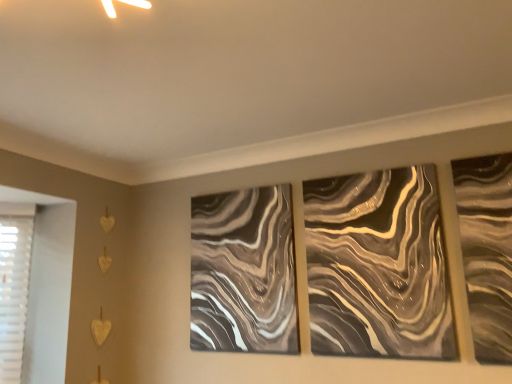
Question: Is metallic swirl art at center-right, acting as the first design starting from the right, at the left side of metallic swirl art at center, positioned as the second design in right-to-left order?

Choices:
 (A) yes
 (B) no

Answer: (B)

Question: Considering the relative sizes of metallic swirl art at center-right, acting as the first design starting from the right, and metallic swirl art at center, the first design from the left, in the image provided, is metallic swirl art at center-right, acting as the first design starting from the right, shorter than metallic swirl art at center, the first design from the left,?

Choices:
 (A) no
 (B) yes

Answer: (B)

Question: Are metallic swirl art at center-right, the 2th design from the left, and metallic swirl art at center, the first design from the left, beside each other?

Choices:
 (A) no
 (B) yes

Answer: (A)

Question: Can we say metallic swirl art at center-right, acting as the first design starting from the right, lies outside metallic swirl art at center, positioned as the second design in right-to-left order?

Choices:
 (A) no
 (B) yes

Answer: (B)

Question: Is metallic swirl art at center-right, the 2th design from the left, wider than metallic swirl art at center, positioned as the second design in right-to-left order?

Choices:
 (A) no
 (B) yes

Answer: (A)

Question: Is metallic swirl art at center-right, acting as the first design starting from the right, oriented towards metallic swirl art at center, the first design from the left?

Choices:
 (A) yes
 (B) no

Answer: (B)

Question: Is metallic swirl art at center-right, the 2th design from the left, a part of metallic swirl art at center, the first design from the left?

Choices:
 (A) yes
 (B) no

Answer: (B)

Question: Considering the relative positions of metallic swirl art at center, the first design from the left, and metallic swirl art at center-right, the 2th design from the left, in the image provided, is metallic swirl art at center, the first design from the left, behind metallic swirl art at center-right, the 2th design from the left,?

Choices:
 (A) no
 (B) yes

Answer: (B)

Question: From a real-world perspective, is metallic swirl art at center, the first design from the left, located higher than metallic swirl art at center-right, acting as the first design starting from the right?

Choices:
 (A) yes
 (B) no

Answer: (A)

Question: Considering the relative sizes of metallic swirl art at center, positioned as the second design in right-to-left order, and metallic swirl art at center-right, acting as the first design starting from the right, in the image provided, is metallic swirl art at center, positioned as the second design in right-to-left order, shorter than metallic swirl art at center-right, acting as the first design starting from the right,?

Choices:
 (A) yes
 (B) no

Answer: (B)

Question: Does metallic swirl art at center, the first design from the left, come in front of metallic swirl art at center-right, acting as the first design starting from the right?

Choices:
 (A) no
 (B) yes

Answer: (A)

Question: In the image, is metallic swirl art at center, the first design from the left, positioned in front of or behind metallic swirl art at center-right, acting as the first design starting from the right?

Choices:
 (A) front
 (B) behind

Answer: (B)